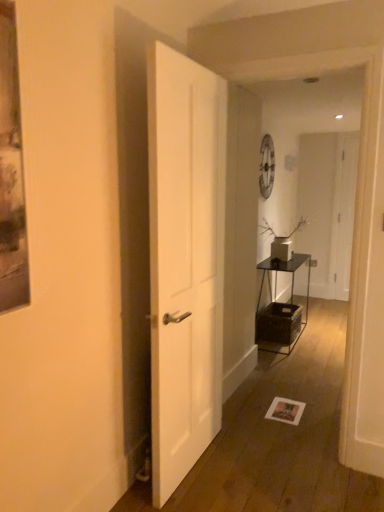
Question: Is white matte door at center, arranged as the 2th door when viewed from the right, oriented towards white matte door at right, the second door viewed from the front?

Choices:
 (A) no
 (B) yes

Answer: (A)

Question: Does white matte door at center, arranged as the 2th door when viewed from the right, touch white matte door at right, marked as the 1th door in a right-to-left arrangement?

Choices:
 (A) no
 (B) yes

Answer: (A)

Question: Is white matte door at center, the first door in the front-to-back sequence, thinner than white matte door at right, which appears as the 1th door when viewed from the back?

Choices:
 (A) no
 (B) yes

Answer: (A)

Question: Is white matte door at center, the first door in the front-to-back sequence, positioned far away from white matte door at right, marked as the 1th door in a right-to-left arrangement?

Choices:
 (A) yes
 (B) no

Answer: (A)

Question: Does white matte door at center, the 2th door positioned from the back, lie in front of white matte door at right, which appears as the 1th door when viewed from the back?

Choices:
 (A) no
 (B) yes

Answer: (B)

Question: Is metallic black table at center-right taller or shorter than white matte door at right, which appears as the second door when viewed from the left?

Choices:
 (A) tall
 (B) short

Answer: (B)

Question: Is point (266, 336) positioned closer to the camera than point (344, 140)?

Choices:
 (A) closer
 (B) farther

Answer: (A)

Question: In terms of width, does metallic black table at center-right look wider or thinner when compared to white matte door at right, the second door viewed from the front?

Choices:
 (A) thin
 (B) wide

Answer: (B)

Question: In terms of size, does metallic black table at center-right appear bigger or smaller than white matte door at right, the second door viewed from the front?

Choices:
 (A) big
 (B) small

Answer: (A)

Question: Is white matte door at right, which appears as the second door when viewed from the left, inside or outside of white matte door at center, marked as the 1th door in a left-to-right arrangement?

Choices:
 (A) inside
 (B) outside

Answer: (B)

Question: From the image's perspective, is white matte door at right, the second door viewed from the front, positioned above or below white matte door at center, marked as the 1th door in a left-to-right arrangement?

Choices:
 (A) above
 (B) below

Answer: (A)

Question: Is white matte door at right, which appears as the 1th door when viewed from the back, wider or thinner than white matte door at center, the first door in the front-to-back sequence?

Choices:
 (A) wide
 (B) thin

Answer: (B)

Question: From a real-world perspective, relative to white matte door at center, marked as the 1th door in a left-to-right arrangement, is white matte door at right, which appears as the 1th door when viewed from the back, vertically above or below?

Choices:
 (A) below
 (B) above

Answer: (B)

Question: In terms of size, does metallic black table at center-right appear bigger or smaller than white matte vase at center-right?

Choices:
 (A) big
 (B) small

Answer: (A)

Question: From a real-world perspective, is metallic black table at center-right physically located above or below white matte vase at center-right?

Choices:
 (A) below
 (B) above

Answer: (A)